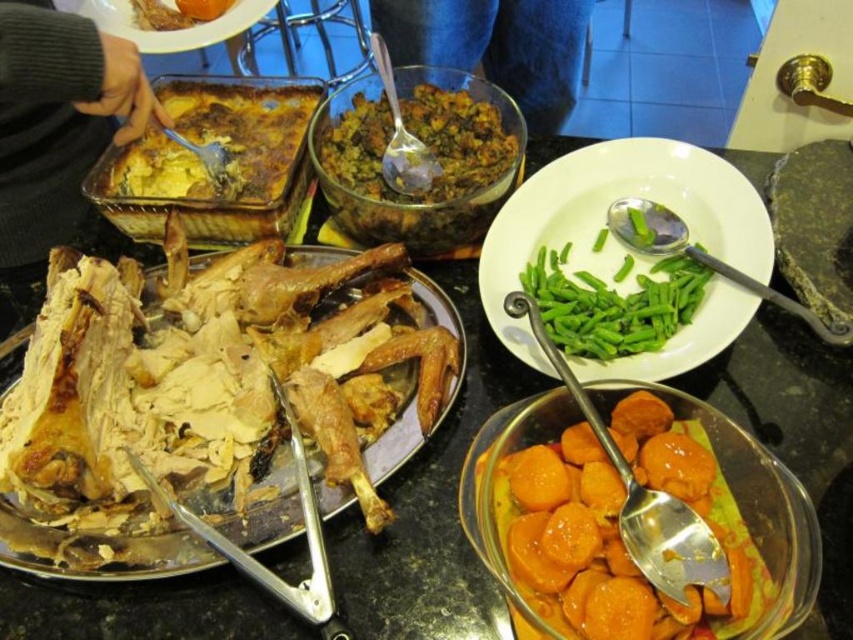
Can you confirm if green matte green beans at center is thinner than brown crumbly stuffing at center?

No, green matte green beans at center is not thinner than brown crumbly stuffing at center.

At what (x,y) coordinates should I click in order to perform the action: click on green matte green beans at center. Please return your answer as a coordinate pair (x, y). This screenshot has height=640, width=853. Looking at the image, I should click on (610, 230).

Which of these two, golden brown crispy chicken at center or golden-brown baked dish at center-left, stands shorter?

golden-brown baked dish at center-left

Find the location of a particular element. This screenshot has width=853, height=640. golden brown crispy chicken at center is located at coordinates (242, 362).

At what (x,y) coordinates should I click in order to perform the action: click on golden brown crispy chicken at center. Please return your answer as a coordinate pair (x, y). The image size is (853, 640). Looking at the image, I should click on (242, 362).

Is point (248, 312) farther from camera compared to point (575, 284)?

No, (248, 312) is closer to viewer.

You are a GUI agent. You are given a task and a screenshot of the screen. Output one action in this format:
    pyautogui.click(x=<x>, y=<y>)
    Task: Click on the golden brown crispy chicken at center
    
    Given the screenshot: What is the action you would take?
    pyautogui.click(x=242, y=362)

Who is more forward, (9, 422) or (697, 300)?

Point (9, 422) is in front.

Image resolution: width=853 pixels, height=640 pixels. What are the coordinates of `golden brown crispy chicken at center` in the screenshot? It's located at (242, 362).